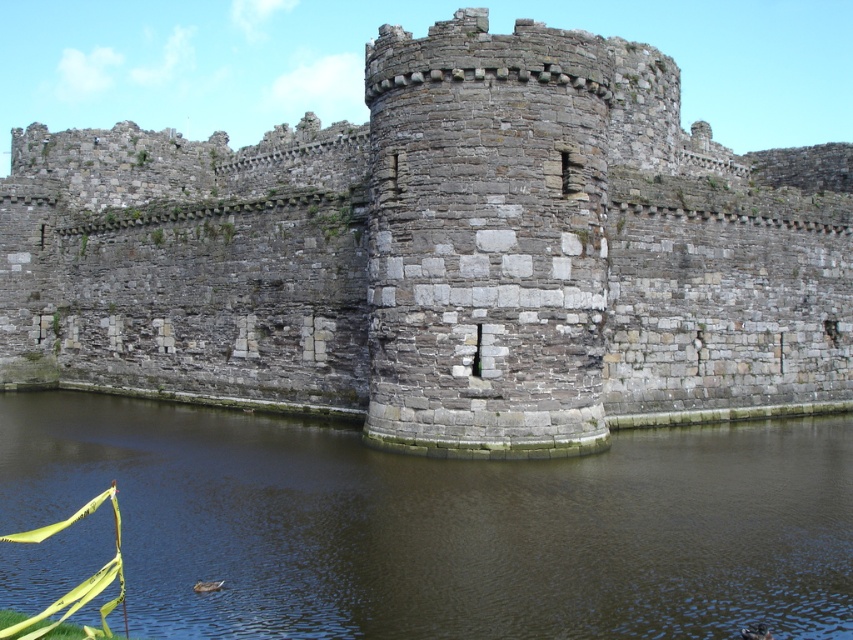
You are a medieval architect examining the castle structure. You notice the gray stone wall at center and the brown stone water at center. Which of these two objects is positioned to the right side of the other?

The gray stone wall at center is positioned to the right of the brown stone water at center.

From the picture: You are a medieval architect designing a moat around the gray stone wall at center and the brown stone water at center. Based on their widths, which structure should you prioritize reinforcing to ensure the castle remains secure?

The gray stone wall at center might be wider than brown stone water at center, so reinforcing the gray stone wall at center would be more critical to maintain the castle security.

You are standing at the base of the castle wall and want to reach a specific point marked at coordinates point (x=90, y=378). If you walk directly towards it, how far will you have to travel?

The point (x=90, y=378) is 77.48 meters away from the camera, so you will have to travel 77.48 meters to reach it.